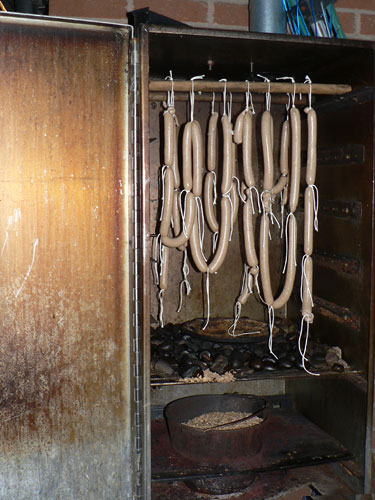
Find the location of `hanging rack`. hanging rack is located at coordinates (335, 88).